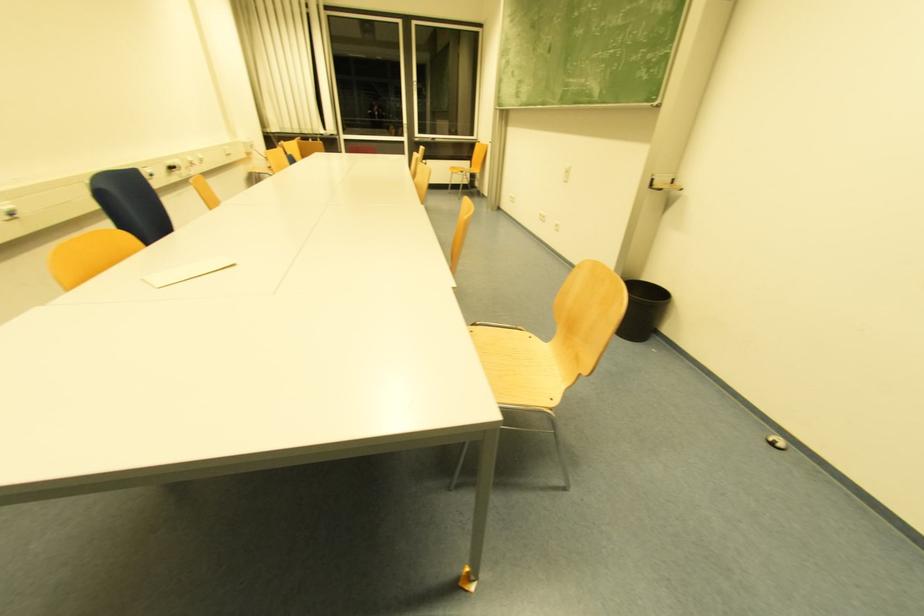
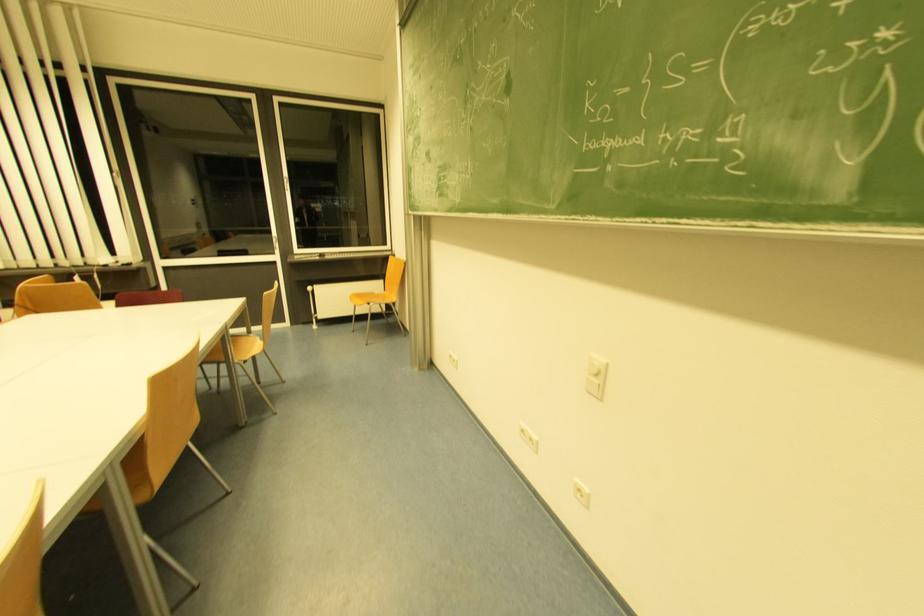
Question: What movement of the cameraman would produce the second image?

Choices:
 (A) Left
 (B) Right
 (C) Forward
 (D) Backward

Answer: (C)